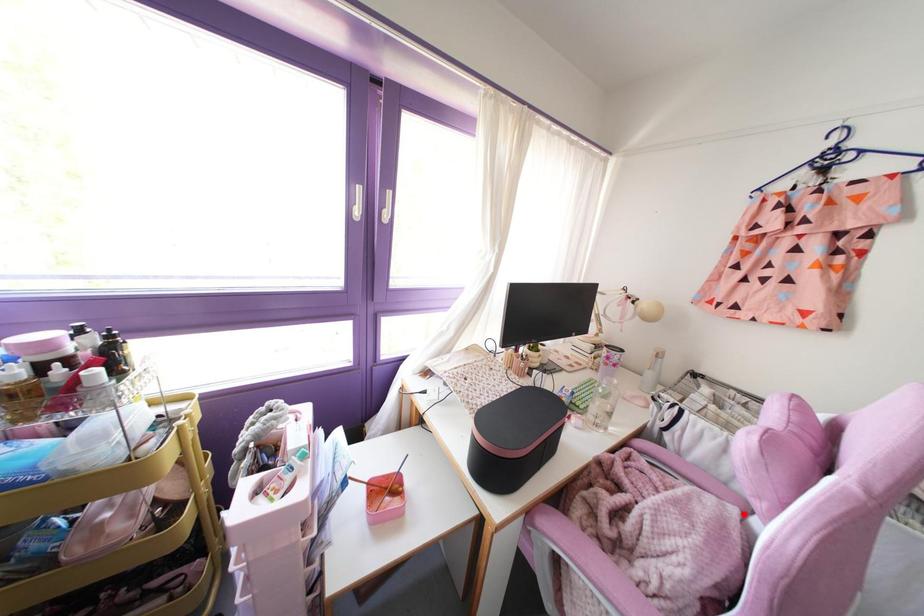
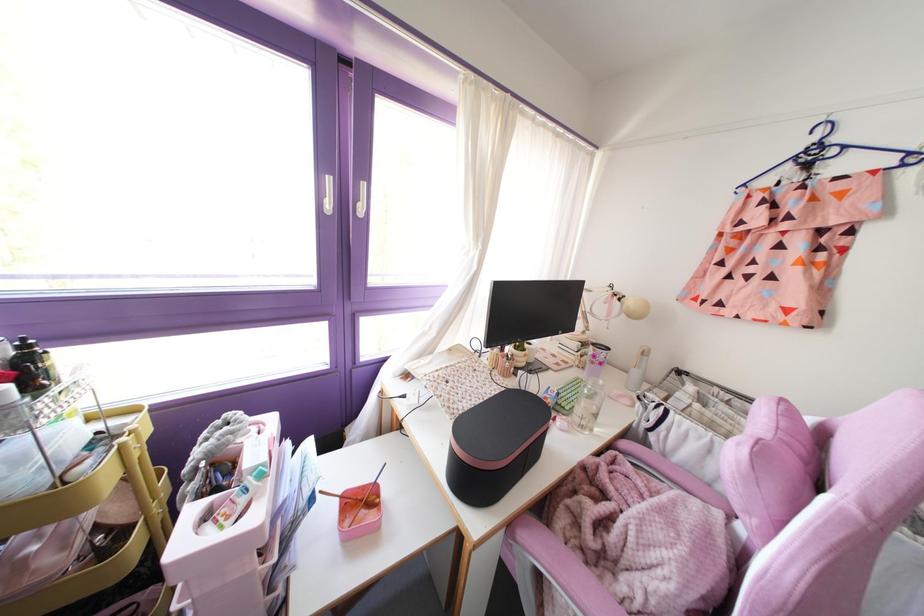
Question: I am providing you with two images of the same scene from different viewpoints. Given a red point in image1, look at the same physical point in image2. Is it:

Choices:
 (A) Closer to the viewpoint
 (B) Farther from the viewpoint

Answer: (A)